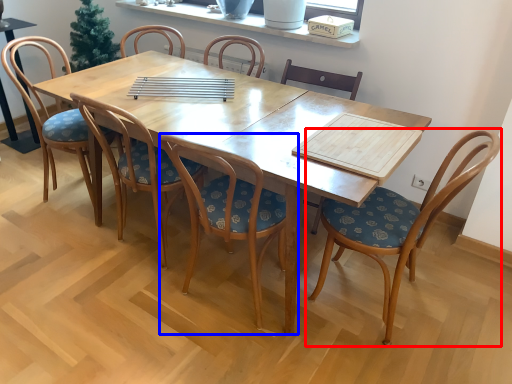
Question: Which object appears closest to the camera in this image, chair (highlighted by a red box) or chair (highlighted by a blue box)?

Choices:
 (A) chair
 (B) chair

Answer: (B)